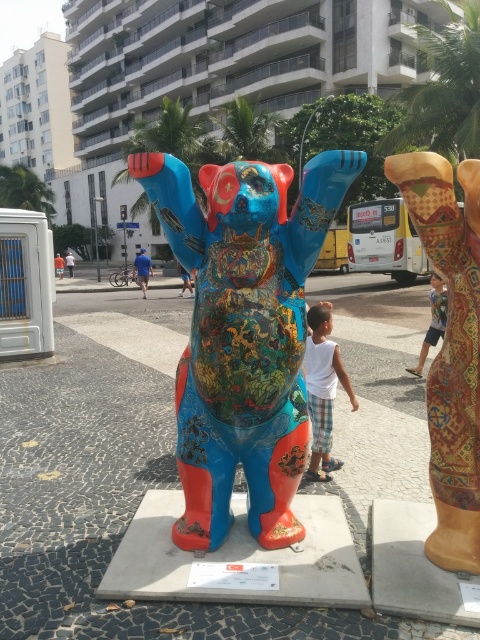
The height and width of the screenshot is (640, 480). Describe the element at coordinates (450, 348) in the screenshot. I see `textured fabric leg at right` at that location.

Which of these two, textured fabric leg at right or light blue denim shorts at lower right, stands shorter?

Standing shorter between the two is light blue denim shorts at lower right.

Between point (474, 342) and point (445, 296), which one is positioned in front?

Point (474, 342)

At what (x,y) coordinates should I click in order to perform the action: click on textured fabric leg at right. Please return your answer as a coordinate pair (x, y). The height and width of the screenshot is (640, 480). Looking at the image, I should click on (450, 348).

Can you confirm if multicolored painted bear at center is positioned to the left of white cotton shirt at center?

Indeed, multicolored painted bear at center is positioned on the left side of white cotton shirt at center.

Which is more to the left, multicolored painted bear at center or white cotton shirt at center?

multicolored painted bear at center

Where is `multicolored painted bear at center`? This screenshot has width=480, height=640. multicolored painted bear at center is located at coordinates (243, 332).

Who is lower down, white cotton shirt at center or light blue denim shorts at lower right?

light blue denim shorts at lower right is lower down.

Between point (315, 412) and point (437, 323), which one is positioned behind?

The point (437, 323) is more distant.

Image resolution: width=480 pixels, height=640 pixels. What are the coordinates of `white cotton shirt at center` in the screenshot? It's located at (323, 388).